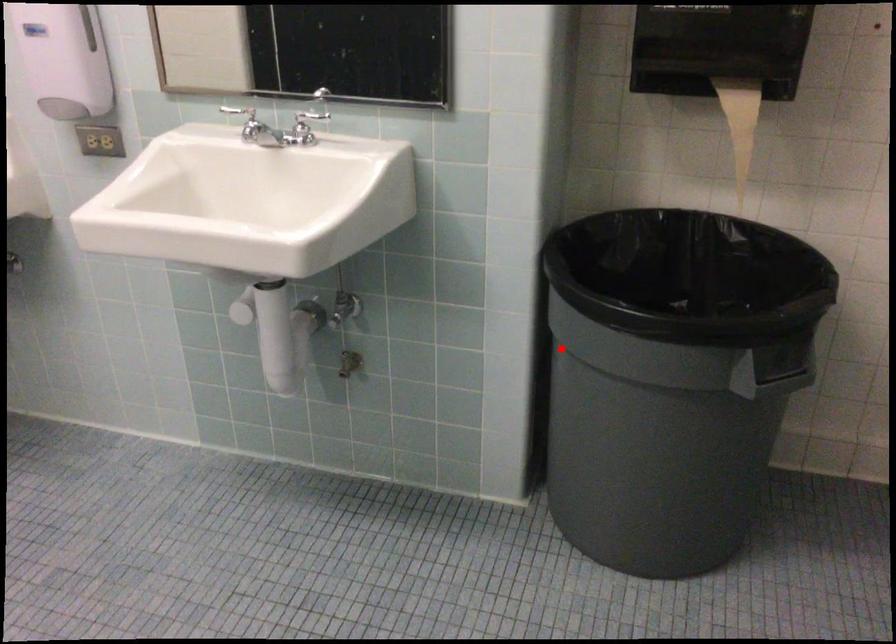
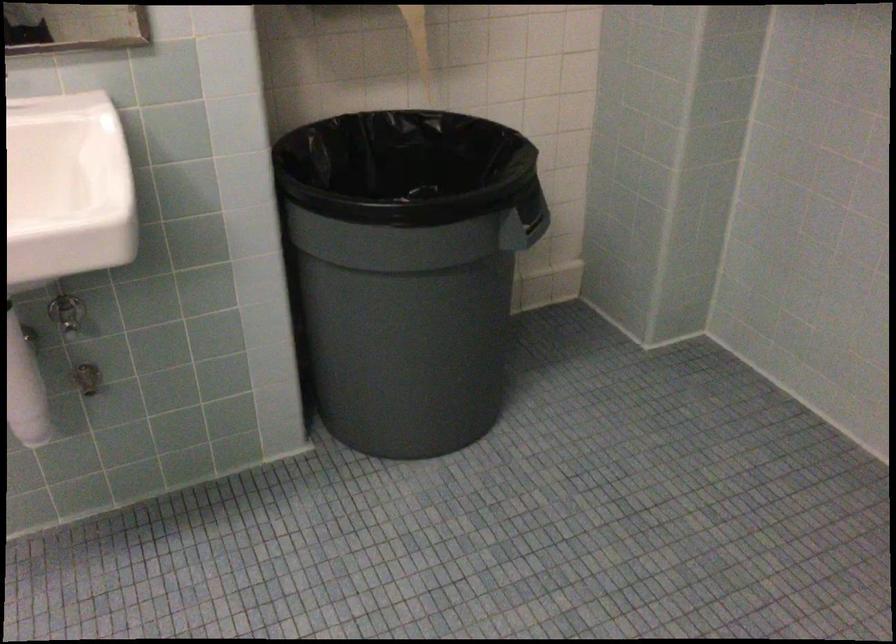
In the second image, find the point that corresponds to the highlighted location in the first image.

(332, 272)